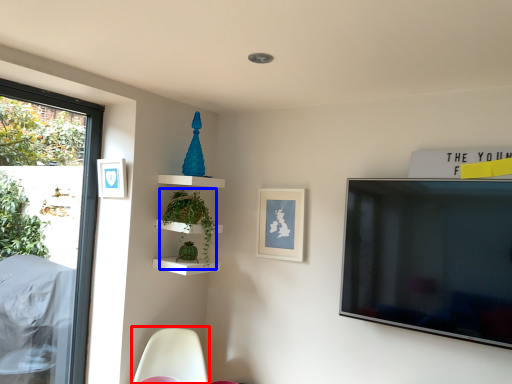
Question: Which point is further to the camera, swivel chair (highlighted by a red box) or plant (highlighted by a blue box)?

Choices:
 (A) swivel chair
 (B) plant

Answer: (B)